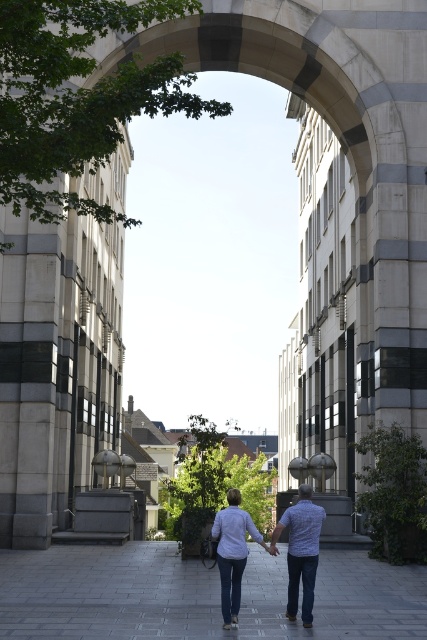
Question: Is gray concrete pavement at center closer to the viewer compared to light blue denim jeans at center?

Choices:
 (A) no
 (B) yes

Answer: (B)

Question: Which object appears farthest from the camera in this image?

Choices:
 (A) plaid shirt at center
 (B) gray concrete pavement at center
 (C) light blue denim jeans at center

Answer: (A)

Question: Can you confirm if gray concrete pavement at center is positioned to the left of light blue denim jeans at center?

Choices:
 (A) no
 (B) yes

Answer: (B)

Question: In this image, where is gray concrete pavement at center located relative to light blue denim jeans at center?

Choices:
 (A) below
 (B) above

Answer: (A)

Question: Considering the real-world distances, which object is closest to the plaid shirt at center?

Choices:
 (A) gray concrete pavement at center
 (B) light blue denim jeans at center

Answer: (B)

Question: Which point is closer to the camera?

Choices:
 (A) gray concrete pavement at center
 (B) plaid shirt at center
 (C) light blue denim jeans at center

Answer: (A)